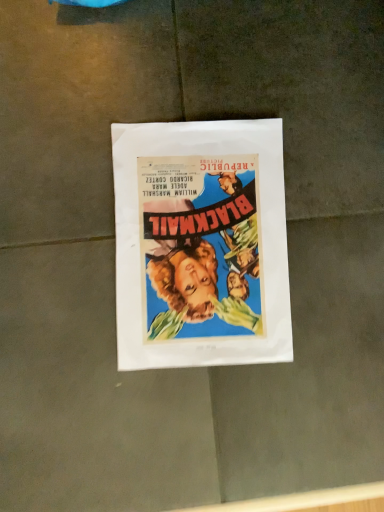
Image resolution: width=384 pixels, height=512 pixels. I want to click on free location above matte paper poster at center (from a real-world perspective), so click(x=200, y=233).